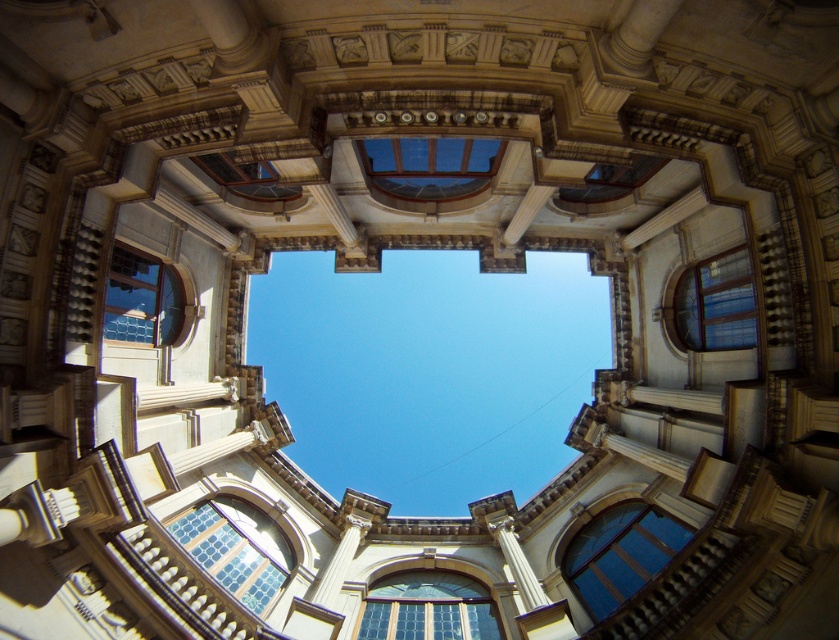
Between stained glass window at left and matte glass window at upper center, which one appears on the right side from the viewer's perspective?

matte glass window at upper center

Does stained glass window at left have a smaller size compared to matte glass window at upper center?

Correct, stained glass window at left occupies less space than matte glass window at upper center.

Is point (150, 276) in front of point (621, 184)?

Yes.

Locate an element on the screen. stained glass window at left is located at coordinates (142, 300).

Can you confirm if stained glass window at center is positioned below stained glass window at left?

Indeed, stained glass window at center is positioned under stained glass window at left.

Can you confirm if stained glass window at center is wider than stained glass window at left?

Yes.

Who is more forward, (x=488, y=604) or (x=183, y=305)?

Positioned in front is point (x=488, y=604).

This screenshot has width=839, height=640. I want to click on stained glass window at center, so click(x=426, y=608).

Does blue glass window at lower right have a greater height compared to clear glass window at center?

Correct, blue glass window at lower right is much taller as clear glass window at center.

Is blue glass window at lower right wider than clear glass window at center?

In fact, blue glass window at lower right might be narrower than clear glass window at center.

Which is behind, point (613, 552) or point (433, 141)?

The point (613, 552) is behind.

Locate an element on the screen. The image size is (839, 640). blue glass window at lower right is located at coordinates (619, 554).